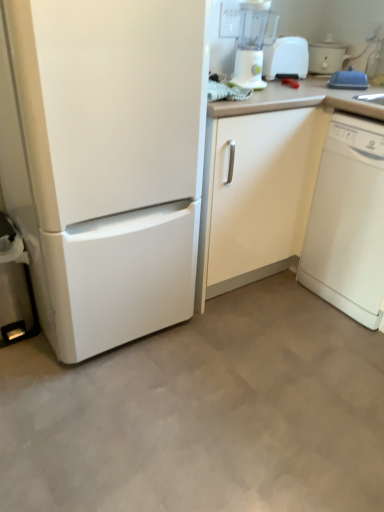
Question: Can you confirm if white glossy dishwasher at right is thinner than white plastic toaster at upper right?

Choices:
 (A) no
 (B) yes

Answer: (A)

Question: Is white glossy dishwasher at right touching white plastic toaster at upper right?

Choices:
 (A) yes
 (B) no

Answer: (B)

Question: Is white glossy dishwasher at right oriented away from white plastic toaster at upper right?

Choices:
 (A) yes
 (B) no

Answer: (B)

Question: Is white glossy dishwasher at right smaller than white plastic toaster at upper right?

Choices:
 (A) yes
 (B) no

Answer: (B)

Question: From the image's perspective, is white glossy dishwasher at right over white plastic toaster at upper right?

Choices:
 (A) no
 (B) yes

Answer: (A)

Question: Is white glossy dishwasher at right completely or partially outside of white plastic toaster at upper right?

Choices:
 (A) no
 (B) yes

Answer: (B)

Question: Does white plastic toaster at upper right touch white glossy cabinet at center?

Choices:
 (A) yes
 (B) no

Answer: (B)

Question: Can you confirm if white plastic toaster at upper right is wider than white glossy cabinet at center?

Choices:
 (A) yes
 (B) no

Answer: (B)

Question: Could white glossy cabinet at center be considered to be inside white plastic toaster at upper right?

Choices:
 (A) no
 (B) yes

Answer: (A)

Question: Is white plastic toaster at upper right not within white glossy cabinet at center?

Choices:
 (A) yes
 (B) no

Answer: (A)

Question: From a real-world perspective, is white plastic toaster at upper right located higher than white glossy cabinet at center?

Choices:
 (A) no
 (B) yes

Answer: (B)

Question: Is white plastic toaster at upper right bigger than white glossy cabinet at center?

Choices:
 (A) no
 (B) yes

Answer: (A)

Question: From a real-world perspective, is white plastic blender at upper right positioned over white matte refrigerator at left based on gravity?

Choices:
 (A) no
 (B) yes

Answer: (B)